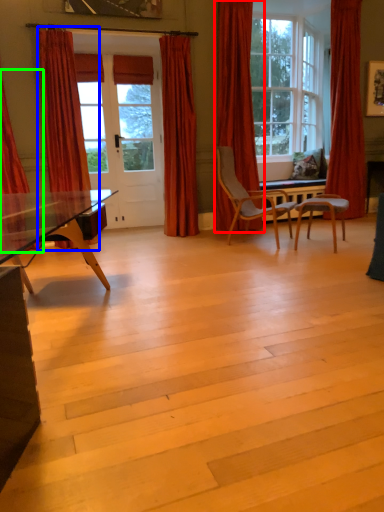
Question: Which object is the farthest from curtain (highlighted by a red box)? Choose among these: curtain (highlighted by a blue box) or curtain (highlighted by a green box).

Choices:
 (A) curtain
 (B) curtain

Answer: (B)